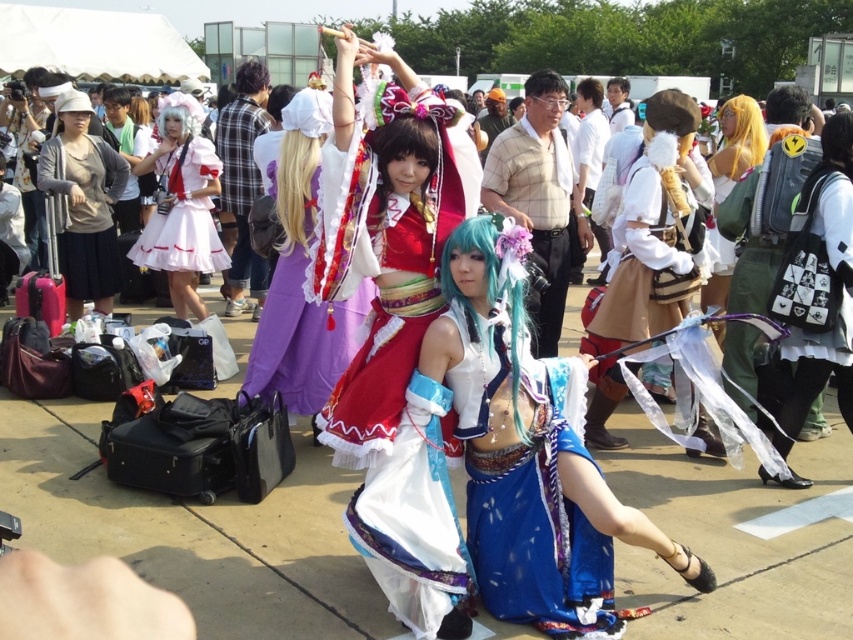
You are a photographer at the event and want to capture both the shiny blue fabric dress at center and the blue satin dress at center in a single shot. Which dress should you focus on first to ensure both are in frame, considering their heights?

The shiny blue fabric dress at center is taller than the blue satin dress at center, so you should focus on the shiny blue fabric dress at center first to ensure both are in frame.

You are at a cosplay event and want to take a photo of the shiny blue fabric dress at center and the matte gray sweater at left. Which object should you focus on first if you want to capture both in the same frame without moving the camera?

The shiny blue fabric dress at center is positioned under the matte gray sweater at left, so you should focus on the matte gray sweater at left first to ensure it stays in frame while adjusting the camera settings for the dress below.

You are organizing a cosplay event and need to arrange two dresses on a display stand. The shiny blue fabric dress at center and the blue satin dress at center. Which dress should you choose if you want the larger one for the main display?

The shiny blue fabric dress at center is bigger than the blue satin dress at center, so you should choose the shiny blue fabric dress at center for the main display.